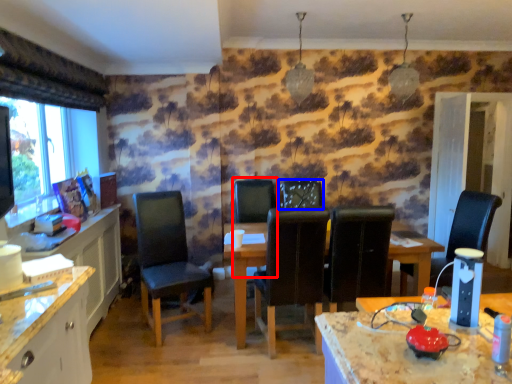
Question: Among these objects, which one is farthest to the camera, armchair (highlighted by a red box) or chair (highlighted by a blue box)?

Choices:
 (A) armchair
 (B) chair

Answer: (A)